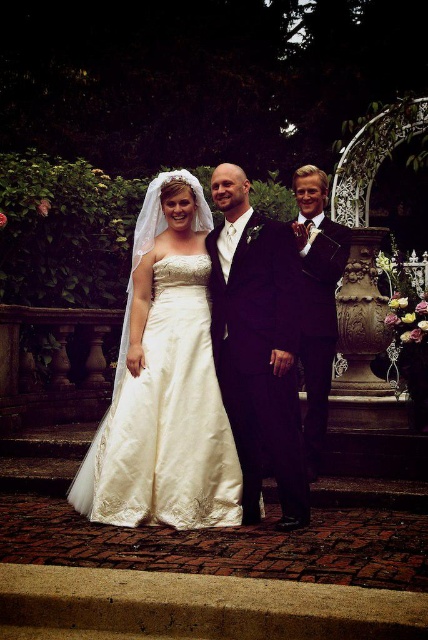
Who is positioned more to the left, satin black suit at center or satin suit at right?

Positioned to the left is satin black suit at center.

What are the coordinates of `satin black suit at center` in the screenshot? It's located at (256, 344).

Which of these two, satin dress at center or satin suit at right, stands taller?

With more height is satin dress at center.

Between point (204, 196) and point (314, 246), which one is positioned in front?

Point (314, 246)

Describe the element at coordinates (165, 381) in the screenshot. I see `satin dress at center` at that location.

In order to click on satin dress at center in this screenshot , I will do `click(165, 381)`.

Between satin dress at center and satin black suit at center, which one appears on the left side from the viewer's perspective?

satin dress at center is more to the left.

Does satin dress at center lie in front of satin black suit at center?

That is False.

Between point (130, 481) and point (284, 298), which one is positioned behind?

The point (284, 298) is more distant.

At what (x,y) coordinates should I click in order to perform the action: click on satin dress at center. Please return your answer as a coordinate pair (x, y). The height and width of the screenshot is (640, 428). Looking at the image, I should click on coord(165,381).